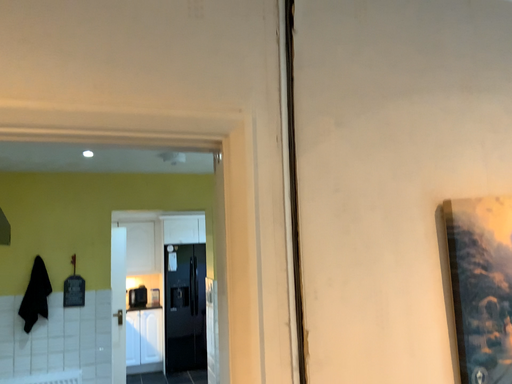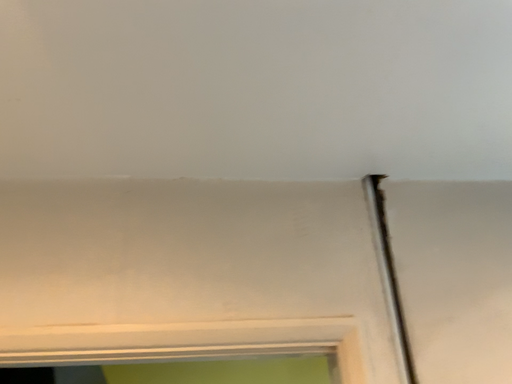
Question: How did the camera likely rotate when shooting the video?

Choices:
 (A) rotated downward
 (B) rotated upward

Answer: (B)